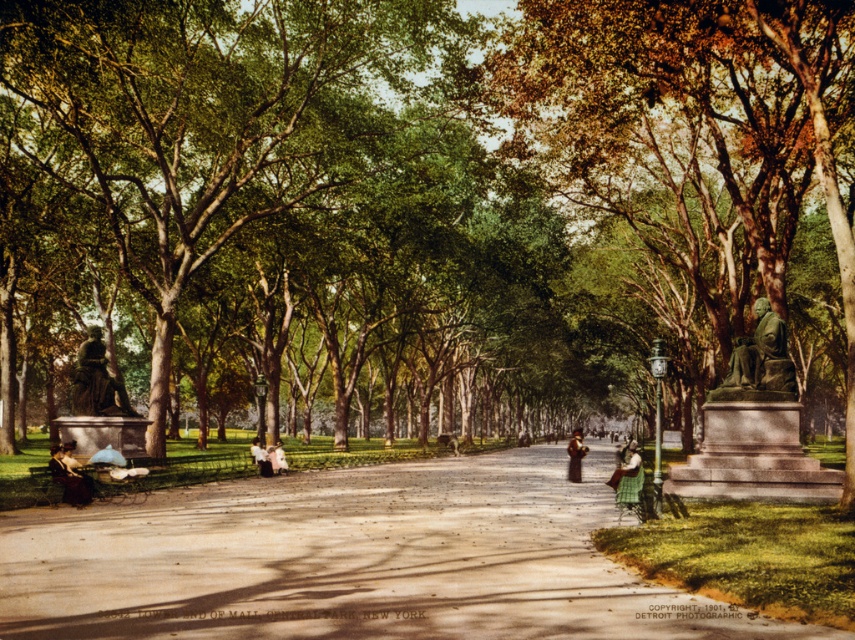
Question: Does matte black bust at left appear on the left side of white cotton dress at center?

Choices:
 (A) no
 (B) yes

Answer: (B)

Question: Among these objects, which one is nearest to the camera?

Choices:
 (A) bronze statue at left
 (B) dark brown coat at center

Answer: (A)

Question: Which of the following is the farthest from the observer?

Choices:
 (A) (101, 412)
 (B) (280, 444)

Answer: (B)

Question: Can you confirm if bronze statue at left is bigger than white cotton dress at center?

Choices:
 (A) yes
 (B) no

Answer: (B)

Question: Which of the following is the closest to the observer?

Choices:
 (A) green fabric dress at center
 (B) matte black bust at left

Answer: (A)

Question: Is bronze statue at right above dark brown coat at center?

Choices:
 (A) yes
 (B) no

Answer: (A)